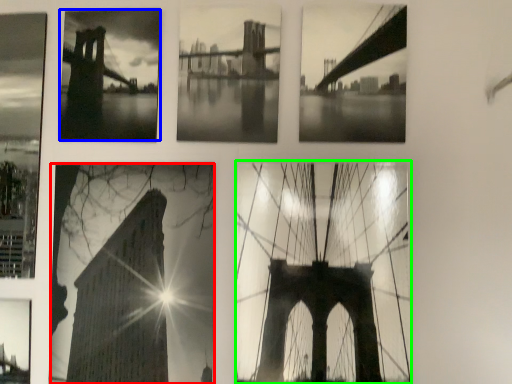
Question: Which is nearer to the picture frame (highlighted by a red box)? picture frame (highlighted by a blue box) or picture frame (highlighted by a green box).

Choices:
 (A) picture frame
 (B) picture frame

Answer: (B)